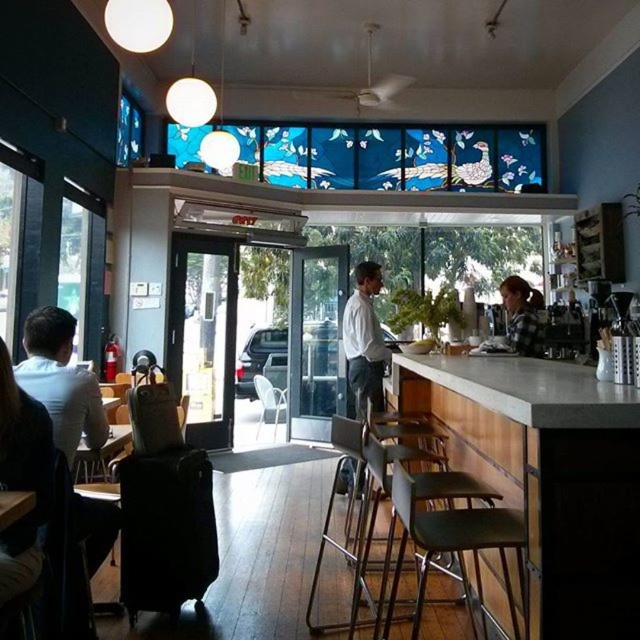
Between white shirt at left and plaid shirt at counter, which one appears on the right side from the viewer's perspective?

plaid shirt at counter

Is point (22, 328) closer to camera compared to point (513, 276)?

That is True.

Locate an element on the screen. The width and height of the screenshot is (640, 640). white shirt at left is located at coordinates (60, 381).

Based on the photo, between smooth concrete bar at center and metallic silver bar stool at center, which one appears on the left side from the viewer's perspective?

metallic silver bar stool at center is more to the left.

Does smooth concrete bar at center have a lesser height compared to metallic silver bar stool at center?

Yes, smooth concrete bar at center is shorter than metallic silver bar stool at center.

Which is in front, point (628, 413) or point (465, 545)?

Point (628, 413) is in front.

You are a GUI agent. You are given a task and a screenshot of the screen. Output one action in this format:
    pyautogui.click(x=<x>, y=<y>)
    Task: Click on the smooth concrete bar at center
    The image size is (640, 640).
    Given the screenshot: What is the action you would take?
    pyautogui.click(x=547, y=476)

Is metallic silver bar stool at center closer to the viewer compared to plaid shirt at counter?

Yes, it is.

Does point (467, 522) come in front of point (540, 348)?

Yes, it is.

This screenshot has width=640, height=640. Find the location of `metallic silver bar stool at center`. metallic silver bar stool at center is located at coordinates (452, 541).